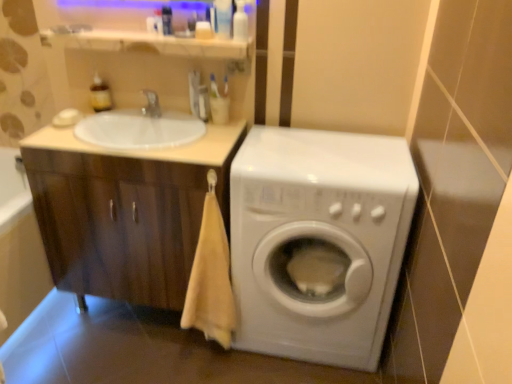
Image resolution: width=512 pixels, height=384 pixels. I want to click on vacant space in front of white matte soap at upper left, which is the second soap in bottom-to-top order, so click(63, 140).